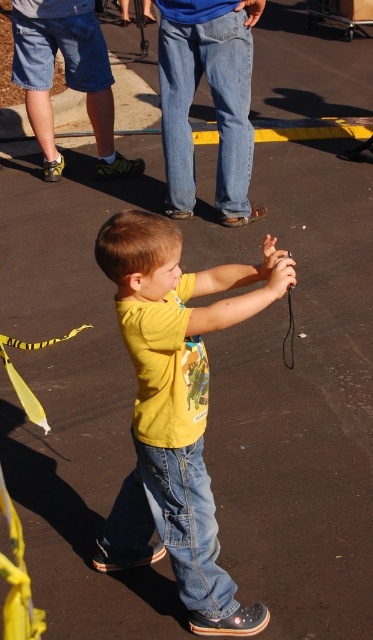
Question: Estimate the real-world distances between objects in this image. Which object is closer to the yellow matte shirt at center?

Choices:
 (A) yellow fabric ribbon at lower left
 (B) jeans at lower center
 (C) blue denim jeans at center

Answer: (B)

Question: Does yellow matte shirt at center have a larger size compared to jeans at lower center?

Choices:
 (A) yes
 (B) no

Answer: (A)

Question: Is blue denim jeans at center smaller than yellow fabric ribbon at lower left?

Choices:
 (A) yes
 (B) no

Answer: (B)

Question: Considering the real-world distances, which object is closest to the yellow fabric ribbon at lower left?

Choices:
 (A) jeans at lower center
 (B) yellow matte shirt at center

Answer: (B)

Question: Which is farther from the yellow fabric ribbon at lower left?

Choices:
 (A) jeans at lower center
 (B) blue denim jeans at center

Answer: (B)

Question: Can you confirm if blue denim jeans at center is wider than jeans at lower center?

Choices:
 (A) no
 (B) yes

Answer: (B)